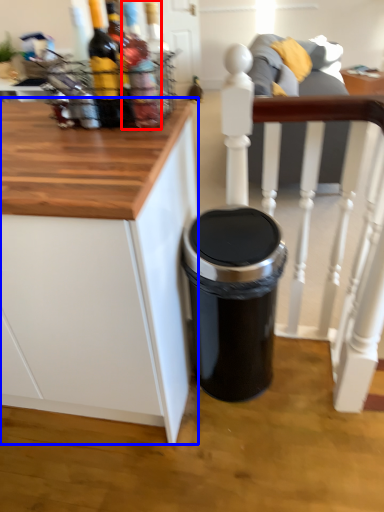
Question: Which object is further to the camera taking this photo, bottle (highlighted by a red box) or cabinetry (highlighted by a blue box)?

Choices:
 (A) bottle
 (B) cabinetry

Answer: (A)